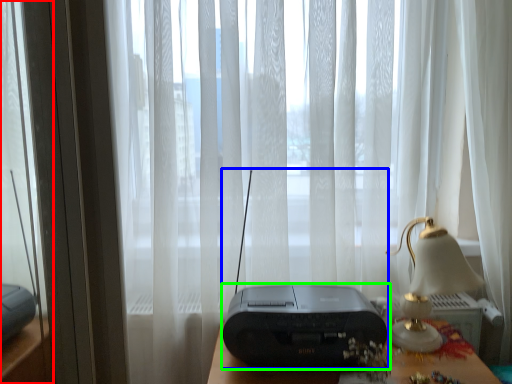
Question: Based on their relative distances, which object is farther from glass door (highlighted by a red box)? Choose from gadget (highlighted by a blue box) and printer (highlighted by a green box).

Choices:
 (A) gadget
 (B) printer

Answer: (B)